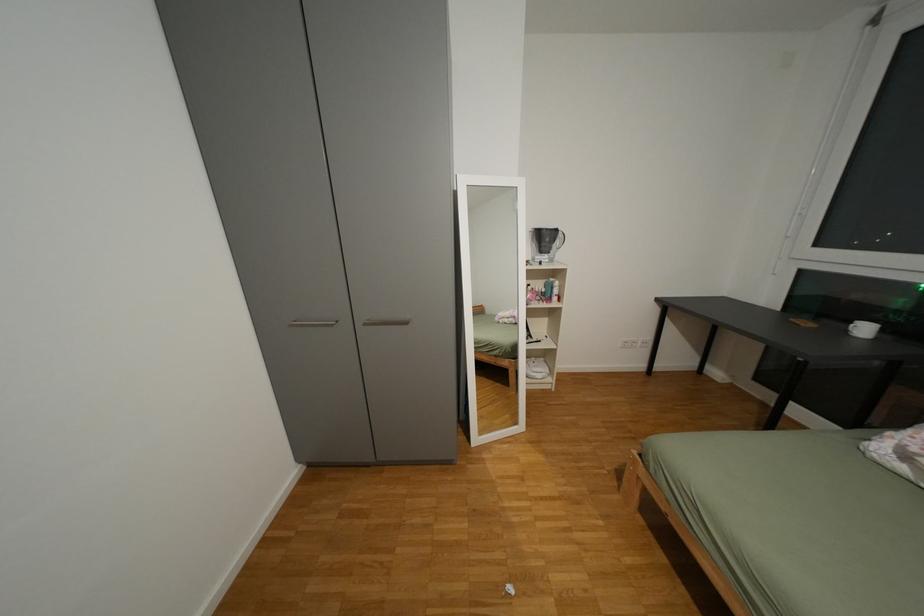
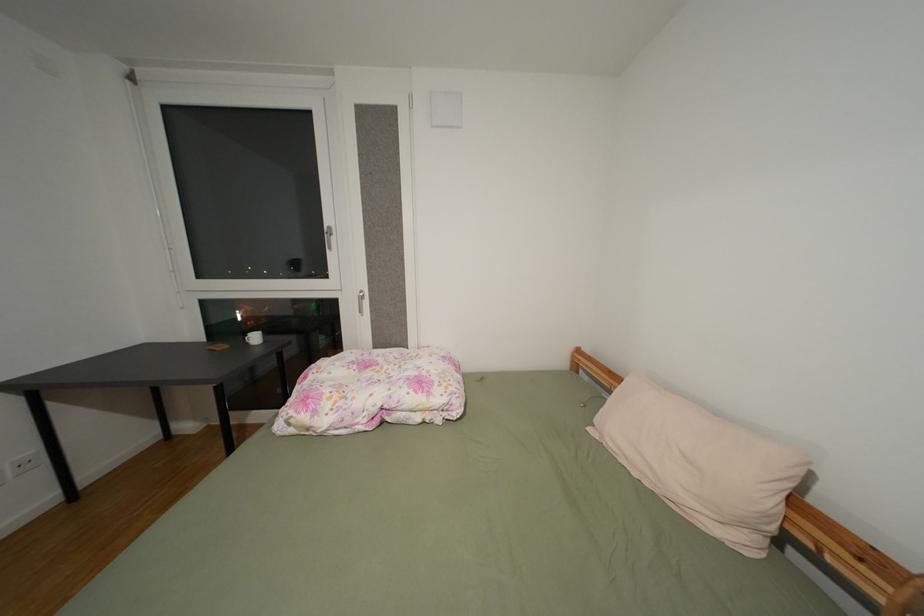
Question: The camera is either moving clockwise (left) or counter-clockwise (right) around the object. The first image is from the beginning of the video and the second image is from the end. Is the camera moving left or right when shooting the video?

Choices:
 (A) Left
 (B) Right

Answer: (A)